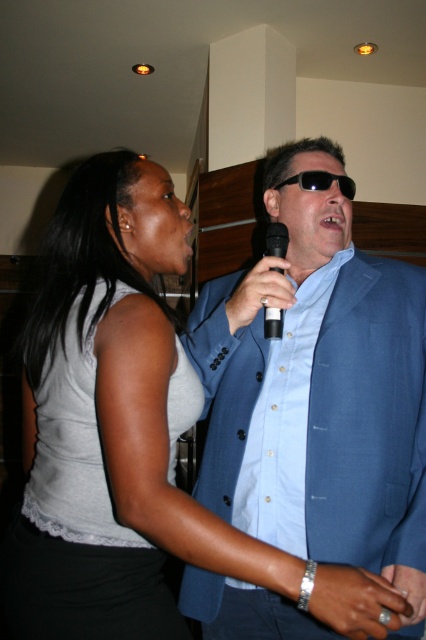
You are a photographer at a fashion show. You need to capture a photo where the blue fabric suit at center is visible above the gray lace tank top at upper left. Based on the scene description, is this arrangement possible?

Yes, the arrangement is possible because the blue fabric suit at center is already positioned above the gray lace tank top at upper left according to the description.

You are a photographer setting up for a group photo. You notice the blue fabric suit at center and the black plastic microphone at center. Which object should you adjust your camera focus on first if you want to ensure both are in focus, considering their heights?

The blue fabric suit at center is taller than the black plastic microphone at center. To ensure both are in focus, adjust the camera focus starting from the blue fabric suit at center first, then the microphone.

You are a photographer at a music event. You need to capture a photo of both the black plastic microphone at center and the black plastic sunglasses at center. Based on their positions, which object should you focus on first to ensure both are in frame?

The black plastic microphone at center is to the left of black plastic sunglasses at center, so you should focus on the black plastic microphone at center first to ensure both are in frame.